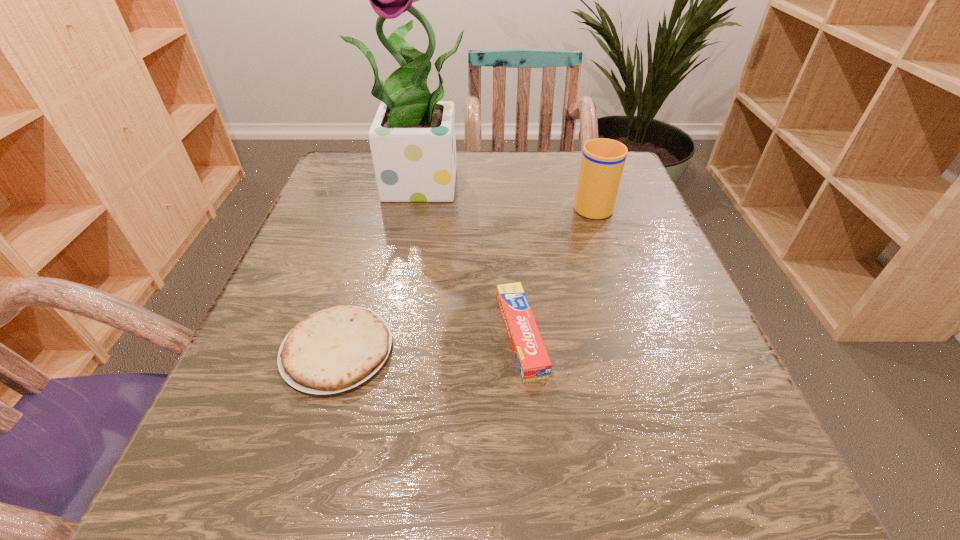
Locate an element on the screen. The height and width of the screenshot is (540, 960). free space at the near edge is located at coordinates (366, 458).

In the image, there is a desktop. What are the coordinates of `vacant space at the left edge` in the screenshot? It's located at (333, 225).

In the image, there is a desktop. Where is `free space at the right edge`? This screenshot has height=540, width=960. free space at the right edge is located at coordinates (602, 308).

Where is `vacant region at the far left corner of the desktop`? Image resolution: width=960 pixels, height=540 pixels. vacant region at the far left corner of the desktop is located at coordinates (370, 161).

Locate an element on the screen. This screenshot has width=960, height=540. free location at the near left corner of the desktop is located at coordinates tap(324, 450).

I want to click on vacant area at the far right corner, so pyautogui.click(x=628, y=199).

This screenshot has width=960, height=540. I want to click on vacant region between the flower arrangement and the tortilla, so click(383, 266).

At what (x,y) coordinates should I click in order to perform the action: click on vacant region between the flower arrangement and the second tallest object. Please return your answer as a coordinate pair (x, y). The height and width of the screenshot is (540, 960). Looking at the image, I should click on pos(510,193).

The image size is (960, 540). I want to click on free space that is in between the second tallest object and the tortilla, so click(x=465, y=277).

You are a GUI agent. You are given a task and a screenshot of the screen. Output one action in this format:
    pyautogui.click(x=<x>, y=<y>)
    Task: Click on the vacant space that's between the third shortest object and the shortest object
    
    Given the screenshot: What is the action you would take?
    pyautogui.click(x=465, y=277)